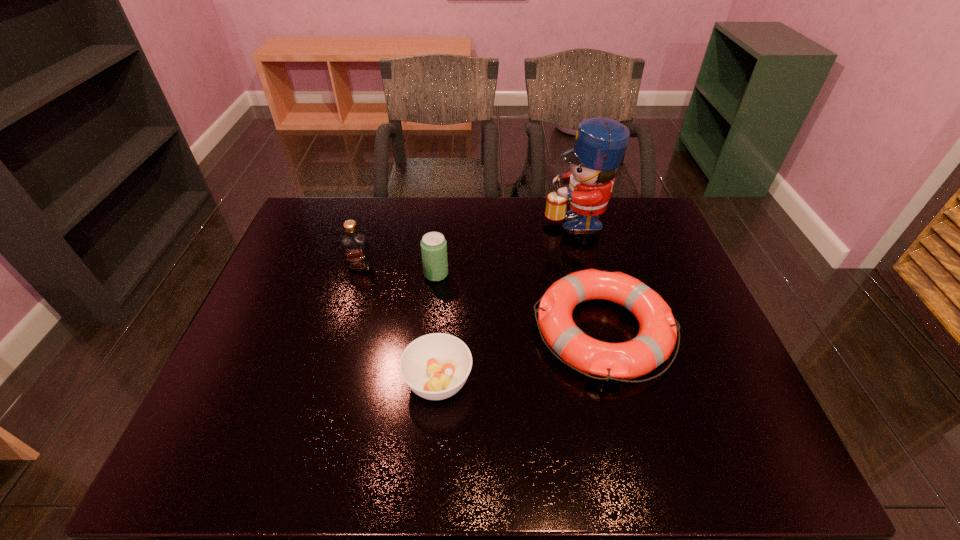
This screenshot has height=540, width=960. I want to click on vacant space located 0.290m on the front-facing side of the fourth shortest object, so click(x=335, y=353).

I want to click on free space located on the front of the soda, so click(x=422, y=411).

Where is `free space located 0.350m on the left of the life buoy`? free space located 0.350m on the left of the life buoy is located at coordinates (398, 330).

Where is `vacant space located on the right of the soup bowl`? This screenshot has width=960, height=540. vacant space located on the right of the soup bowl is located at coordinates (627, 381).

Image resolution: width=960 pixels, height=540 pixels. Find the location of `object situated at the far edge`. object situated at the far edge is located at coordinates (600, 143).

Where is `object positioned at the right edge`? Image resolution: width=960 pixels, height=540 pixels. object positioned at the right edge is located at coordinates (655, 341).

The image size is (960, 540). In order to click on vacant point at the far edge in this screenshot , I will do `click(409, 213)`.

Identify the location of vacant area at the near edge. (311, 447).

Identify the location of free space at the left edge of the desktop. (279, 282).

This screenshot has height=540, width=960. In the image, there is a desktop. What are the coordinates of `free space at the far left corner` in the screenshot? It's located at (316, 240).